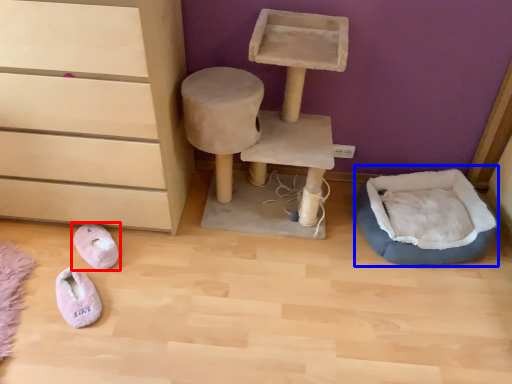
Question: Which of the following is the closest to the observer, footwear (highlighted by a red box) or bean bag chair (highlighted by a blue box)?

Choices:
 (A) footwear
 (B) bean bag chair

Answer: (B)